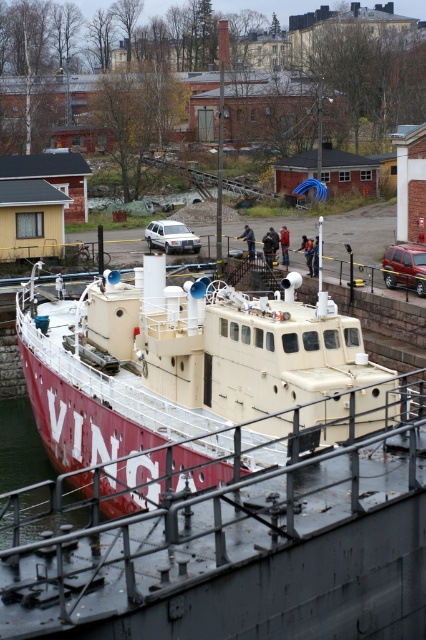
Can you confirm if metallic gray rail at lower center is taller than red matte boat at center?

In fact, metallic gray rail at lower center may be shorter than red matte boat at center.

Describe the element at coordinates (233, 550) in the screenshot. The image size is (426, 640). I see `metallic gray rail at lower center` at that location.

Locate an element on the screen. metallic gray rail at lower center is located at coordinates (233, 550).